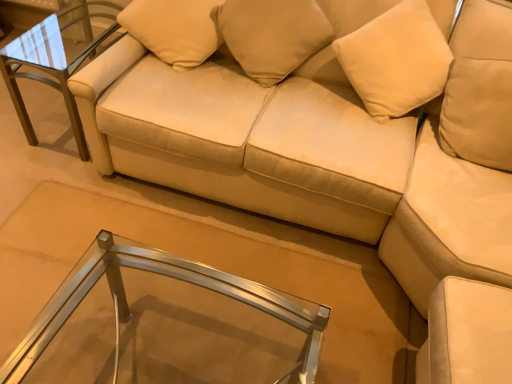
Identify the location of beige fabric pillow at upper center, which appears as the first pillow when viewed from the left. (174, 29).

Where is `beige fabric pillow at upper center, which appears as the first pillow when viewed from the left`? beige fabric pillow at upper center, which appears as the first pillow when viewed from the left is located at coordinates (174, 29).

From the image's perspective, would you say beige fabric pillow at upper center, which appears as the first pillow when viewed from the left, is positioned over beige fabric pillow at upper center, the first pillow positioned from the right?

Yes, from the image's perspective, beige fabric pillow at upper center, which appears as the first pillow when viewed from the left, is above beige fabric pillow at upper center, the first pillow positioned from the right.

Does beige fabric pillow at upper center, which appears as the 2th pillow when viewed from the right, lie in front of beige fabric pillow at upper center, the 2th pillow viewed from the left?

No, it is behind beige fabric pillow at upper center, the 2th pillow viewed from the left.

Considering the positions of point (159, 53) and point (254, 44), is point (159, 53) closer or farther from the camera than point (254, 44)?

Point (159, 53) is positioned farther from the camera compared to point (254, 44).

Locate an element on the screen. pillow that is in front of the beige fabric pillow at upper center, which appears as the first pillow when viewed from the left is located at coordinates (272, 35).

Is beige fabric pillow at upper center, the first pillow positioned from the right, looking in the opposite direction of metal/glass side table at upper left, which ranks as the 2th table in front-to-back order?

No, beige fabric pillow at upper center, the first pillow positioned from the right,'s orientation is not away from metal/glass side table at upper left, which ranks as the 2th table in front-to-back order.

Starting from the metal/glass side table at upper left, which is counted as the first table, starting from the top, which pillow is the 2nd one in front? Please provide its 2D coordinates.

[(272, 35)]

Which of these two, beige fabric pillow at upper center, the first pillow positioned from the right, or metal/glass side table at upper left, placed as the 2th table when sorted from right to left, is smaller?

Smaller between the two is beige fabric pillow at upper center, the first pillow positioned from the right.

From a real-world perspective, is metal/glass side table at upper left, the 2th table from the bottom, physically above beige fabric pillow at upper center, which appears as the first pillow when viewed from the left?

No.

Is beige fabric pillow at upper center, which appears as the first pillow when viewed from the left, at the back of metal/glass side table at upper left, which is counted as the first table, starting from the top?

No.

Can you tell me how much metal/glass side table at upper left, placed as the 2th table when sorted from right to left, and beige fabric pillow at upper center, which appears as the 2th pillow when viewed from the right, differ in facing direction?

19.9 degrees separate the facing orientations of metal/glass side table at upper left, placed as the 2th table when sorted from right to left, and beige fabric pillow at upper center, which appears as the 2th pillow when viewed from the right.

Relative to beige fabric pillow at upper center, which appears as the 2th pillow when viewed from the right, is metal/glass side table at upper left, placed as the 2th table when sorted from right to left, in front or behind?

metal/glass side table at upper left, placed as the 2th table when sorted from right to left, is positioned farther from the viewer than beige fabric pillow at upper center, which appears as the 2th pillow when viewed from the right.

Is clear glass table at center, the 1th table in the front-to-back sequence, not close to beige fabric pillow at upper center, the 2th pillow viewed from the left?

Yes.

Does clear glass table at center, positioned as the second table in top-to-bottom order, appear on the left side of beige fabric pillow at upper center, the 2th pillow viewed from the left?

Yes, clear glass table at center, positioned as the second table in top-to-bottom order, is to the left of beige fabric pillow at upper center, the 2th pillow viewed from the left.

Is clear glass table at center, placed as the 1th table when sorted from bottom to top, taller than beige fabric pillow at upper center, the first pillow positioned from the right?

No, clear glass table at center, placed as the 1th table when sorted from bottom to top, is not taller than beige fabric pillow at upper center, the first pillow positioned from the right.

In the image, is clear glass table at center, placed as the 1th table when sorted from bottom to top, positioned in front of or behind beige fabric pillow at upper center, the first pillow positioned from the right?

clear glass table at center, placed as the 1th table when sorted from bottom to top, is positioned closer to the viewer than beige fabric pillow at upper center, the first pillow positioned from the right.

From the picture: Considering the sizes of objects beige fabric pillow at upper center, which appears as the 2th pillow when viewed from the right, and metal/glass side table at upper left, placed as the 2th table when sorted from right to left, in the image provided, who is shorter, beige fabric pillow at upper center, which appears as the 2th pillow when viewed from the right, or metal/glass side table at upper left, placed as the 2th table when sorted from right to left,?

beige fabric pillow at upper center, which appears as the 2th pillow when viewed from the right.

Is beige fabric pillow at upper center, which appears as the 2th pillow when viewed from the right, wider or thinner than metal/glass side table at upper left, the 1th table viewed from the left?

Considering their sizes, beige fabric pillow at upper center, which appears as the 2th pillow when viewed from the right, looks slimmer than metal/glass side table at upper left, the 1th table viewed from the left.

How different are the orientations of beige fabric pillow at upper center, which appears as the first pillow when viewed from the left, and metal/glass side table at upper left, the 1th table viewed from the left, in degrees?

The facing directions of beige fabric pillow at upper center, which appears as the first pillow when viewed from the left, and metal/glass side table at upper left, the 1th table viewed from the left, are 19.9 degrees apart.

From a real-world perspective, is beige fabric pillow at upper center, which appears as the 2th pillow when viewed from the right, above or below metal/glass side table at upper left, which is counted as the first table, starting from the top?

Clearly, from a real-world perspective, beige fabric pillow at upper center, which appears as the 2th pillow when viewed from the right, is above metal/glass side table at upper left, which is counted as the first table, starting from the top.

Is clear glass table at center, positioned as the second table in top-to-bottom order, inside beige fabric pillow at upper center, the first pillow positioned from the right?

No, clear glass table at center, positioned as the second table in top-to-bottom order, is not a part of beige fabric pillow at upper center, the first pillow positioned from the right.

Which is in front, beige fabric pillow at upper center, the first pillow positioned from the right, or clear glass table at center, the 1th table in the front-to-back sequence?

clear glass table at center, the 1th table in the front-to-back sequence.

Which is in front, point (287, 50) or point (16, 365)?

The point (16, 365) is more forward.

From a real-world perspective, which is physically above, beige fabric pillow at upper center, the 2th pillow viewed from the left, or clear glass table at center, placed as the 1th table when sorted from bottom to top?

beige fabric pillow at upper center, the 2th pillow viewed from the left, is physically above.

Between clear glass table at center, the 1th table in the front-to-back sequence, and beige fabric pillow at upper center, which appears as the first pillow when viewed from the left, which one has less height?

beige fabric pillow at upper center, which appears as the first pillow when viewed from the left, is shorter.

Is clear glass table at center, the first table in the right-to-left sequence, wider or thinner than beige fabric pillow at upper center, which appears as the first pillow when viewed from the left?

In the image, clear glass table at center, the first table in the right-to-left sequence, appears to be wider than beige fabric pillow at upper center, which appears as the first pillow when viewed from the left.

Is clear glass table at center, which is counted as the 2th table, starting from the back, turned away from beige fabric pillow at upper center, which appears as the first pillow when viewed from the left?

No, clear glass table at center, which is counted as the 2th table, starting from the back,'s orientation is not away from beige fabric pillow at upper center, which appears as the first pillow when viewed from the left.

From a real-world perspective, is clear glass table at center, positioned as the second table in top-to-bottom order, below beige fabric pillow at upper center, which appears as the 2th pillow when viewed from the right?

Yes, from a real-world perspective, clear glass table at center, positioned as the second table in top-to-bottom order, is under beige fabric pillow at upper center, which appears as the 2th pillow when viewed from the right.

Locate an element on the screen. This screenshot has width=512, height=384. pillow above the beige fabric pillow at upper center, which appears as the 2th pillow when viewed from the right (from a real-world perspective) is located at coordinates (272, 35).

This screenshot has height=384, width=512. Identify the location of the 1st table below when counting from the beige fabric pillow at upper center, the 2th pillow viewed from the left (from the image's perspective). (53, 61).

Looking at the image, which one is located closer to beige fabric pillow at upper center, the first pillow positioned from the right, clear glass table at center, the 1th table in the front-to-back sequence, or beige fabric pillow at upper center, which appears as the first pillow when viewed from the left?

Among the two, beige fabric pillow at upper center, which appears as the first pillow when viewed from the left, is located nearer to beige fabric pillow at upper center, the first pillow positioned from the right.

From the image, which object appears to be nearer to beige fabric pillow at upper center, which appears as the first pillow when viewed from the left, clear glass table at center, positioned as the second table in top-to-bottom order, or beige fabric pillow at upper center, the first pillow positioned from the right?

The object closer to beige fabric pillow at upper center, which appears as the first pillow when viewed from the left, is beige fabric pillow at upper center, the first pillow positioned from the right.

Which object lies further to the anchor point beige fabric pillow at upper center, which appears as the 2th pillow when viewed from the right, beige fabric pillow at upper center, the first pillow positioned from the right, or clear glass table at center, the 1th table in the front-to-back sequence?

clear glass table at center, the 1th table in the front-to-back sequence.

Estimate the real-world distances between objects in this image. Which object is further from metal/glass side table at upper left, placed as the 2th table when sorted from right to left, beige fabric pillow at upper center, which appears as the 2th pillow when viewed from the right, or beige fabric pillow at upper center, the first pillow positioned from the right?

beige fabric pillow at upper center, the first pillow positioned from the right, is further to metal/glass side table at upper left, placed as the 2th table when sorted from right to left.

From the image, which object appears to be farther from beige fabric pillow at upper center, which appears as the first pillow when viewed from the left, beige fabric pillow at upper center, the first pillow positioned from the right, or metal/glass side table at upper left, the 2th table from the bottom?

Among the two, metal/glass side table at upper left, the 2th table from the bottom, is located further to beige fabric pillow at upper center, which appears as the first pillow when viewed from the left.

Looking at the image, which one is located closer to beige fabric pillow at upper center, which appears as the 2th pillow when viewed from the right, clear glass table at center, positioned as the second table in top-to-bottom order, or metal/glass side table at upper left, which is counted as the first table, starting from the top?

metal/glass side table at upper left, which is counted as the first table, starting from the top, lies closer to beige fabric pillow at upper center, which appears as the 2th pillow when viewed from the right, than the other object.

Which object lies nearer to the anchor point clear glass table at center, positioned as the second table in top-to-bottom order, beige fabric pillow at upper center, the 2th pillow viewed from the left, or metal/glass side table at upper left, which is counted as the first table, starting from the top?

metal/glass side table at upper left, which is counted as the first table, starting from the top, is closer to clear glass table at center, positioned as the second table in top-to-bottom order.

Based on their spatial positions, is clear glass table at center, the 1th table in the front-to-back sequence, or beige fabric pillow at upper center, the first pillow positioned from the right, further from metal/glass side table at upper left, placed as the 2th table when sorted from right to left?

Based on the image, clear glass table at center, the 1th table in the front-to-back sequence, appears to be further to metal/glass side table at upper left, placed as the 2th table when sorted from right to left.

Where is `pillow between beige fabric pillow at upper center, which appears as the first pillow when viewed from the left, and clear glass table at center, placed as the 1th table when sorted from bottom to top, in the vertical direction`? The image size is (512, 384). pillow between beige fabric pillow at upper center, which appears as the first pillow when viewed from the left, and clear glass table at center, placed as the 1th table when sorted from bottom to top, in the vertical direction is located at coordinates (272, 35).

Locate an element on the screen. The image size is (512, 384). pillow between metal/glass side table at upper left, positioned as the first table in back-to-front order, and beige fabric pillow at upper center, the 2th pillow viewed from the left, from left to right is located at coordinates pyautogui.click(x=174, y=29).

The image size is (512, 384). I want to click on table between beige fabric pillow at upper center, the first pillow positioned from the right, and clear glass table at center, placed as the 1th table when sorted from bottom to top, in the up-down direction, so click(x=53, y=61).

Where is `table between beige fabric pillow at upper center, which appears as the 2th pillow when viewed from the right, and clear glass table at center, the first table in the right-to-left sequence, in the vertical direction`? table between beige fabric pillow at upper center, which appears as the 2th pillow when viewed from the right, and clear glass table at center, the first table in the right-to-left sequence, in the vertical direction is located at coordinates (53, 61).